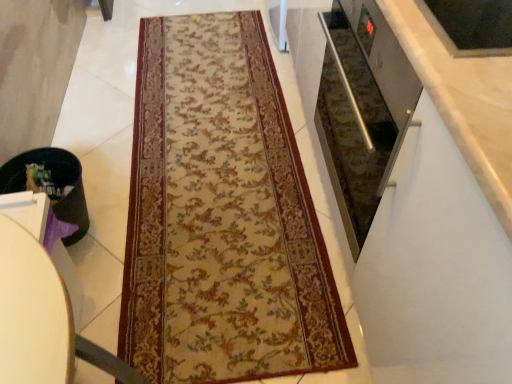
Question: Is beige floral rug at center positioned behind black plastic trash can at lower left?

Choices:
 (A) no
 (B) yes

Answer: (A)

Question: Could you tell me if beige floral rug at center is turned towards black plastic trash can at lower left?

Choices:
 (A) no
 (B) yes

Answer: (A)

Question: Does beige floral rug at center have a greater height compared to black plastic trash can at lower left?

Choices:
 (A) no
 (B) yes

Answer: (A)

Question: Can you confirm if beige floral rug at center is thinner than black plastic trash can at lower left?

Choices:
 (A) yes
 (B) no

Answer: (B)

Question: Does beige floral rug at center appear on the right side of black plastic trash can at lower left?

Choices:
 (A) no
 (B) yes

Answer: (B)

Question: Is beige floral rug at center outside black plastic trash can at lower left?

Choices:
 (A) no
 (B) yes

Answer: (B)

Question: From a real-world perspective, does black plastic trash can at lower left sit lower than beige floral rug at center?

Choices:
 (A) yes
 (B) no

Answer: (B)

Question: Considering the relative sizes of black plastic trash can at lower left and beige floral rug at center in the image provided, is black plastic trash can at lower left bigger than beige floral rug at center?

Choices:
 (A) no
 (B) yes

Answer: (A)

Question: Is black plastic trash can at lower left beside beige floral rug at center?

Choices:
 (A) no
 (B) yes

Answer: (A)

Question: Is beige floral rug at center at the back of black plastic trash can at lower left?

Choices:
 (A) yes
 (B) no

Answer: (B)

Question: Would you say black plastic trash can at lower left contains beige floral rug at center?

Choices:
 (A) no
 (B) yes

Answer: (A)

Question: Is black plastic trash can at lower left closer to camera compared to beige floral rug at center?

Choices:
 (A) yes
 (B) no

Answer: (A)

Question: Is black plastic trash can at lower left at the left side of beige floral rug at center?

Choices:
 (A) no
 (B) yes

Answer: (B)